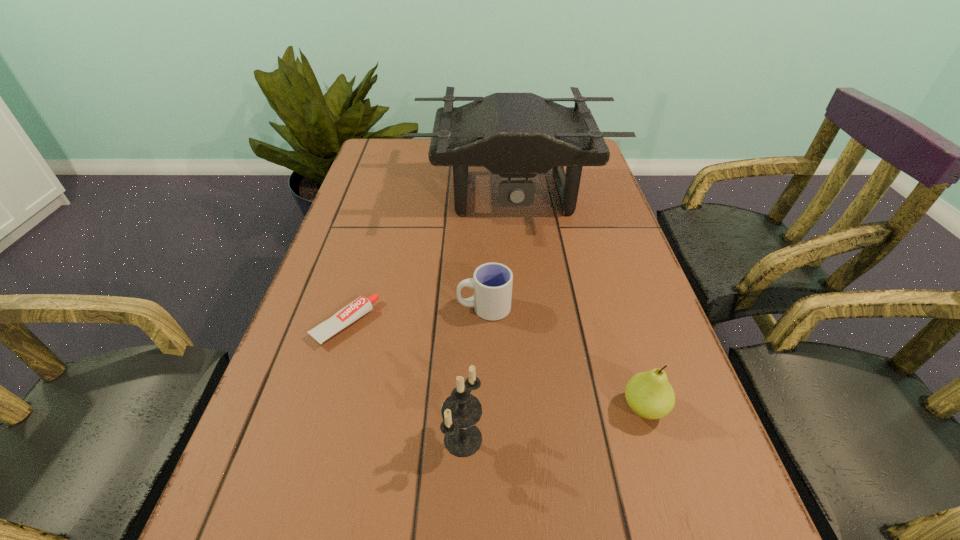
This screenshot has width=960, height=540. In the image, there is a desktop. Find the location of `free space at the right edge`. free space at the right edge is located at coordinates (575, 287).

Find the location of a particular element. Image resolution: width=960 pixels, height=540 pixels. empty space that is in between the third tallest object and the leftmost object is located at coordinates (494, 366).

This screenshot has height=540, width=960. What are the coordinates of `free area in between the farthest object and the cup` in the screenshot? It's located at (498, 250).

Where is `empty space that is in between the pear and the leftmost object`? This screenshot has width=960, height=540. empty space that is in between the pear and the leftmost object is located at coordinates (494, 366).

In order to click on blank region between the pear and the toothpaste in this screenshot , I will do `click(494, 366)`.

Identify the location of blank region between the cup and the drone. Image resolution: width=960 pixels, height=540 pixels. pos(498,250).

In order to click on vacant area that lies between the third tallest object and the fourth shortest object in this screenshot , I will do `click(554, 423)`.

Find the location of a particular element. unoccupied position between the pear and the farthest object is located at coordinates pos(579,300).

This screenshot has height=540, width=960. I want to click on blank region between the farthest object and the cup, so click(498, 250).

Point out which object is positioned as the second nearest to the fourth tallest object. Please provide its 2D coordinates. Your answer should be formatted as a tuple, i.e. [(x, y)], where the tuple contains the x and y coordinates of a point satisfying the conditions above.

[(461, 411)]